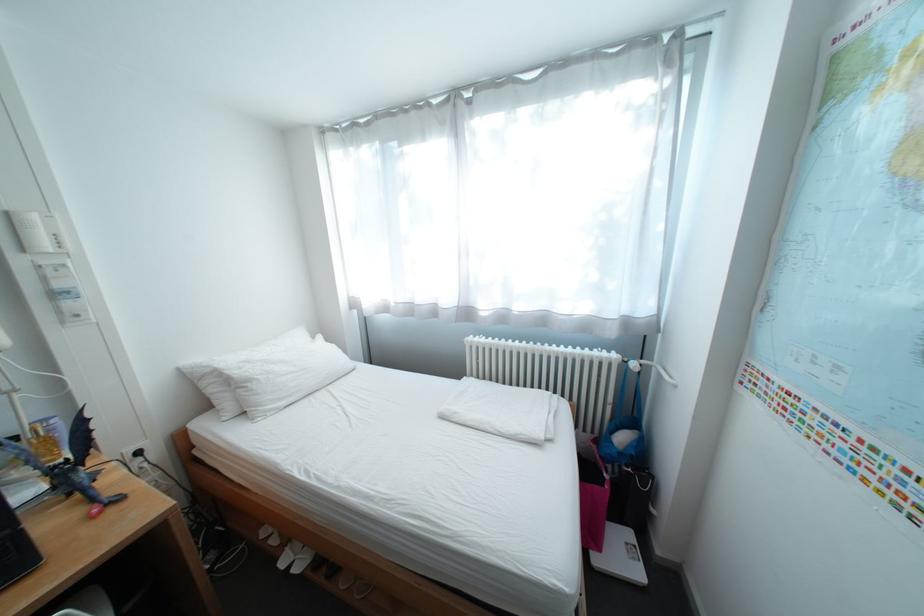
Which object does [79,466] point to?

It corresponds to the dragon figurine in the image.